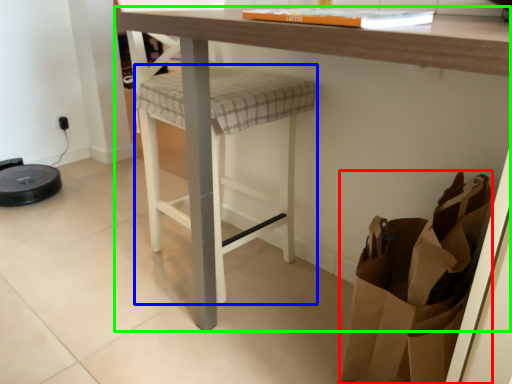
Question: Which is nearer to the shopping bag (highlighted by a red box)? step stool (highlighted by a blue box) or table (highlighted by a green box).

Choices:
 (A) step stool
 (B) table

Answer: (B)